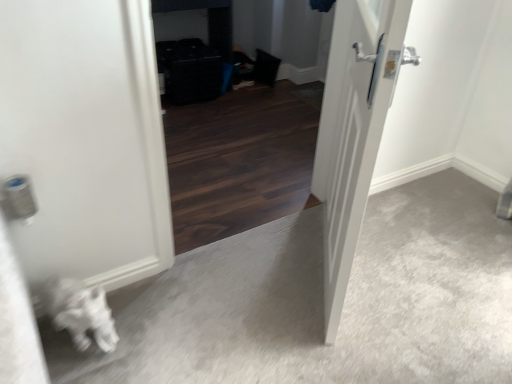
Where is `white glossy door at center`? The image size is (512, 384). white glossy door at center is located at coordinates (353, 130).

This screenshot has height=384, width=512. Describe the element at coordinates (353, 130) in the screenshot. I see `white glossy door at center` at that location.

Identify the location of white glossy door at center. (353, 130).